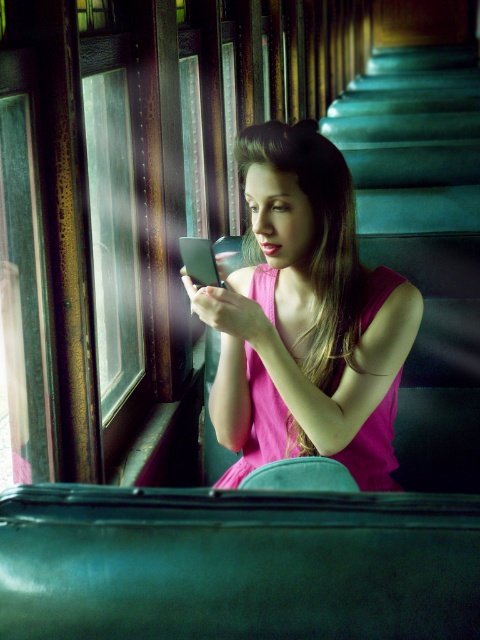
Between point (264, 156) and point (437, 216), which one is positioned in front?

Point (264, 156)

Which of these two, pink satin dress at center or green plush stairs at right, stands shorter?

pink satin dress at center

Which is in front, point (288, 276) or point (360, 161)?

Point (288, 276) is in front.

Where is `pink satin dress at center`? The height and width of the screenshot is (640, 480). pink satin dress at center is located at coordinates (305, 317).